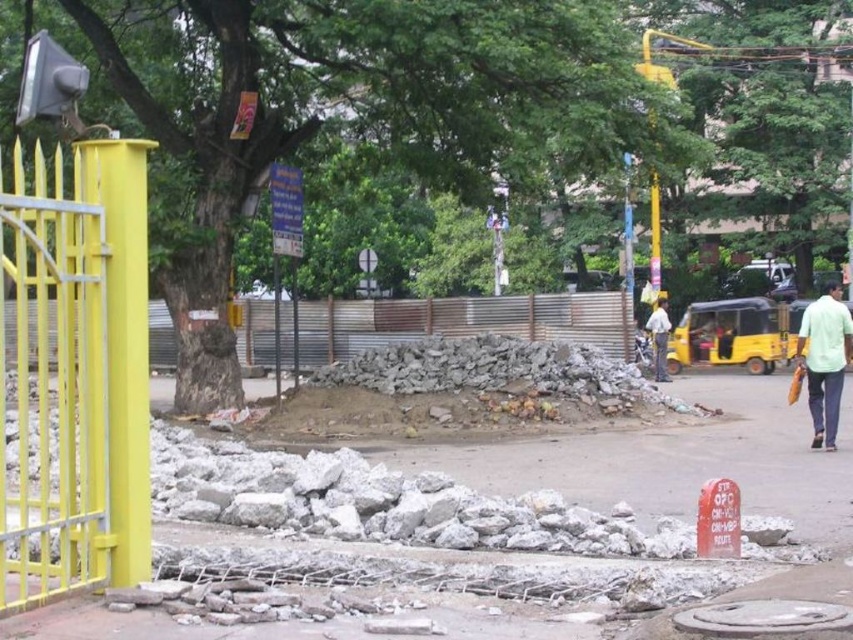
You are standing at the yellow gate on the left and want to walk towards the red sign on the right. Which point, point (322, 307) or point (659, 376), would you encounter first?

You would encounter point (659, 376) first because it is in front of point (322, 307).

You are a delivery person trying to navigate through the construction area. You need to deliver a package that requires a flat surface to avoid damage. Which object between the gray concrete pavement at center and the corrugated metal fence at center should you choose for placing the package?

The gray concrete pavement at center has a lesser height compared to the corrugated metal fence at center, so placing the package on the gray concrete pavement at center would be more stable and less likely to cause damage due to its flatter surface.

You are a pedestrian walking along the street and notice the corrugated metal fence at center and the light blue shirt at center. Which object is nearer to you?

The corrugated metal fence at center is closer to the viewer than the light blue shirt at center.